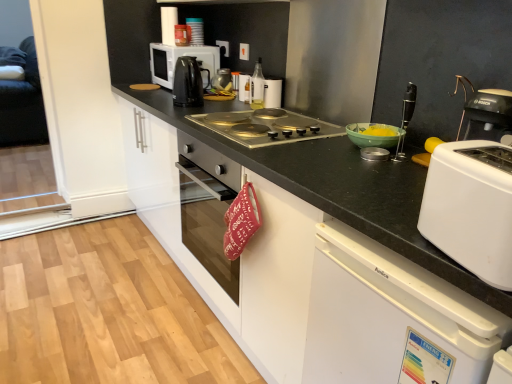
In order to click on free point behind white plastic toaster at right in this screenshot , I will do `click(391, 202)`.